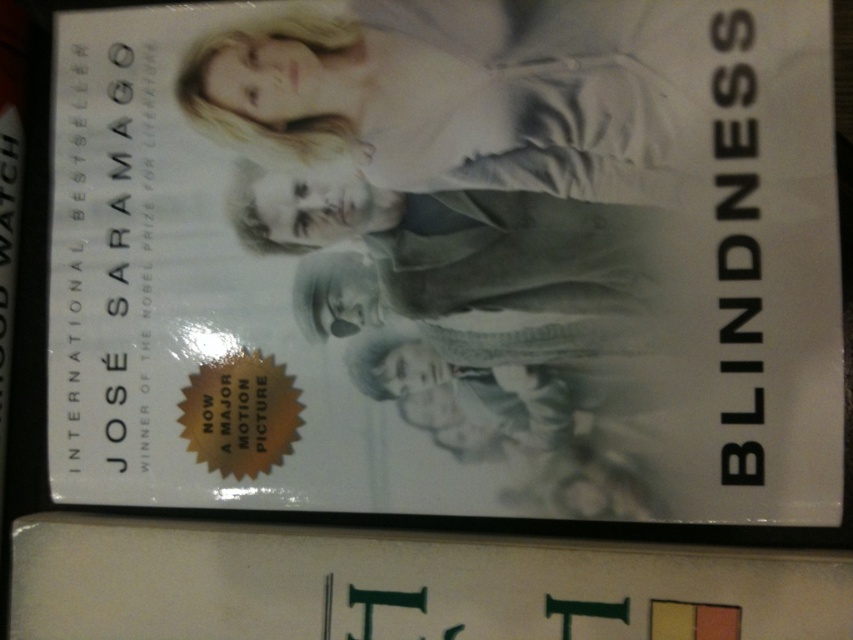
You are an art curator examining the DVD cover for the film Blindness. You notice the light beige fabric at upper center and the smooth gray coat at center. Which object is positioned closer to the viewer?

The light beige fabric at upper center is positioned closer to the viewer as it is in front of the smooth gray coat at center.

Looking at this image, you are designing a poster for a movie theater and need to ensure that the light beige fabric at upper center and the smooth gray coat at center are both visible. Based on their positions in the image, which object should be placed higher on the poster to maintain their original spatial relationship?

The light beige fabric at upper center should be placed higher on the poster since it has a greater height compared to the smooth gray coat at center in the original image.

You are designing a poster for the movie and need to place a title text. The title should be centered horizontally and vertically on the DVD cover. However, there is a light beige fabric at upper center marked by point (451,97). Where should you place the title text to avoid overlapping with the light beige fabric at upper center?

The title text should be placed below the light beige fabric at upper center to avoid overlapping since the point (451,97) marks its position at the upper center.